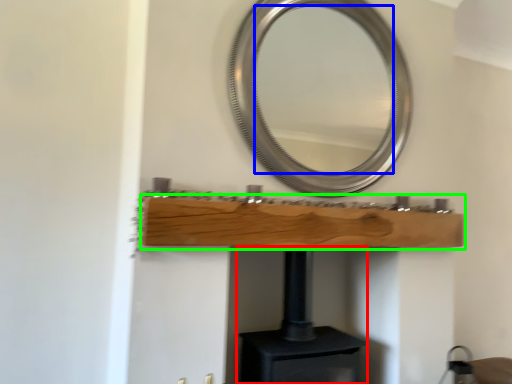
Question: Which object is the farthest from fireplace (highlighted by a red box)? Choose among these: mirror (highlighted by a blue box) or shelf (highlighted by a green box).

Choices:
 (A) mirror
 (B) shelf

Answer: (A)